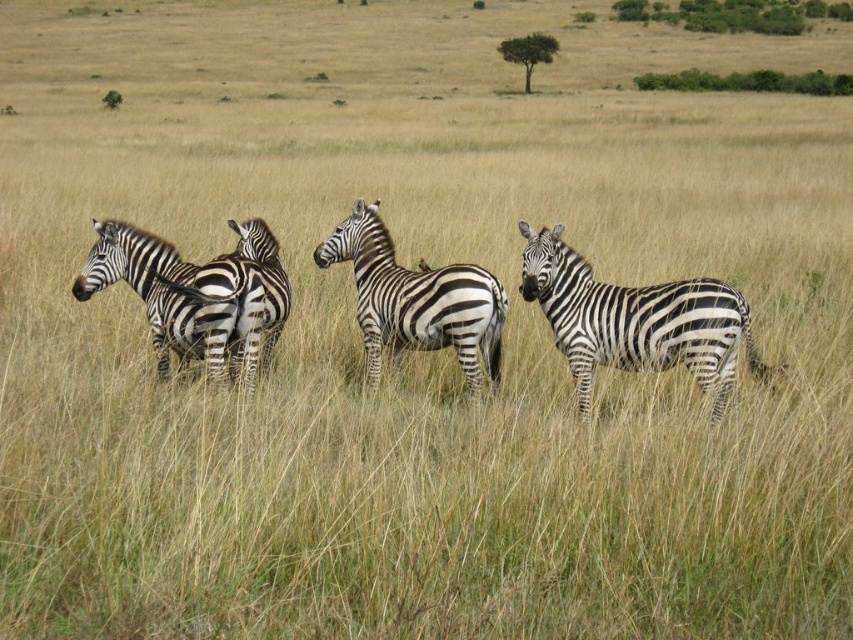
You are a wildlife photographer observing the scene. You need to capture a photo where the black and white striped zebras at left and the black and white striped zebra at center are both visible. Which zebra is positioned lower in the frame?

The black and white striped zebras at left is positioned lower in the frame than the black and white striped zebra at center.

Looking at this image, you are a safari guide leading a tour group and want to point out the zebras. Which of the two black and white striped zebras is positioned further to the east? The zebras are the black and white striped zebra at right and the black and white striped zebra at center.

The black and white striped zebra at right is positioned further to the east because it is to the right of the black and white striped zebra at center, and assuming the image is oriented with east to the right.

You are standing at the origin point of the coordinate system in the image. You see two points, point (x=631, y=288) and point (x=257, y=268). Which point is closer to you?

Point (x=631, y=288) is in front of point (x=257, y=268), so it is closer to you.